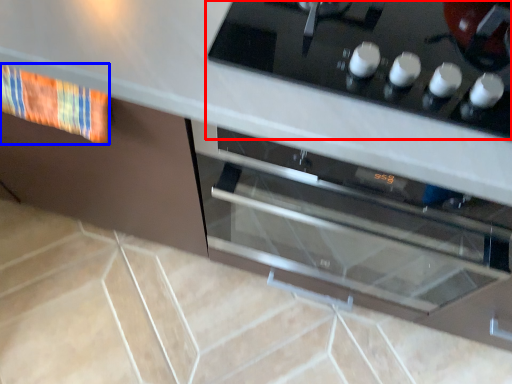
Question: Among these objects, which one is nearest to the camera, home appliance (highlighted by a red box) or material (highlighted by a blue box)?

Choices:
 (A) home appliance
 (B) material

Answer: (A)